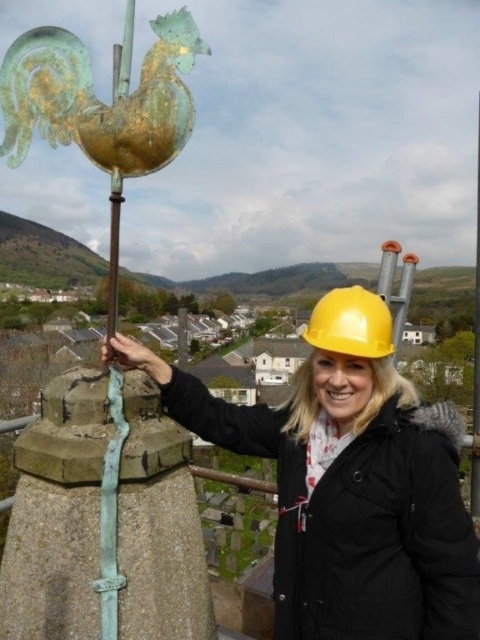
You are a painter standing 6 meters away from the green patina rooster at upper left. Can you reach it with a 1.2 meter long pole?

The distance between the green patina rooster at upper left and viewer is 5.55 meters. Since you are standing 6 meters away, you are slightly farther than the actual distance. The pole is 1.2 meters long, so you cannot reach the green patina rooster at upper left with it.

What are the coordinates of the yellow hard hat at upper center?

The yellow hard hat at upper center is located at coordinates point (349, 483).